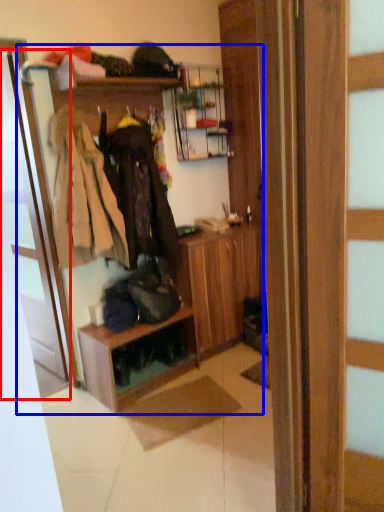
Question: Which of the following is the farthest to the observer, door (highlighted by a red box) or dresser (highlighted by a blue box)?

Choices:
 (A) door
 (B) dresser

Answer: (A)